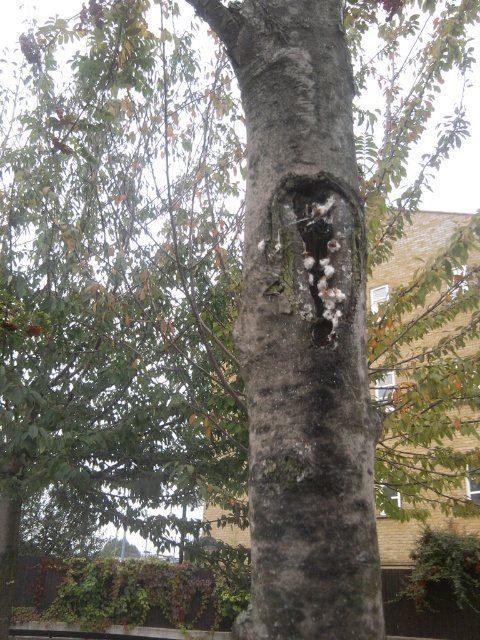
Is gray rough bark tree trunk at center thinner than white fibrous hole at center?

No, gray rough bark tree trunk at center is not thinner than white fibrous hole at center.

Identify the location of gray rough bark tree trunk at center. The width and height of the screenshot is (480, 640). (302, 324).